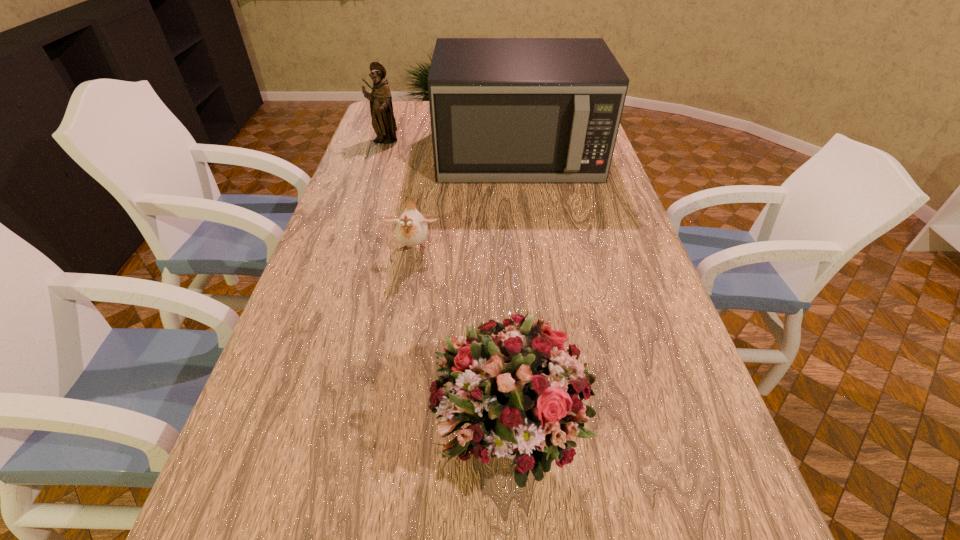
Select which object appears as the closest to the leftmost object. Please provide its 2D coordinates. Your answer should be formatted as a tuple, i.e. [(x, y)], where the tuple contains the x and y coordinates of a point satisfying the conditions above.

[(503, 110)]

Locate which object is the third closest to the nearest object. Please provide its 2D coordinates. Your answer should be formatted as a tuple, i.e. [(x, y)], where the tuple contains the x and y coordinates of a point satisfying the conditions above.

[(383, 122)]

Find the location of a particular element. Image resolution: width=960 pixels, height=540 pixels. free space that satisfies the following two spatial constraints: 1. on the front-facing side of the bouquet; 2. on the right side of the figurine is located at coordinates (290, 434).

Where is `free location that satisfies the following two spatial constraints: 1. at the beak of the bird; 2. on the left side of the nearest object`? free location that satisfies the following two spatial constraints: 1. at the beak of the bird; 2. on the left side of the nearest object is located at coordinates (383, 434).

This screenshot has width=960, height=540. I want to click on vacant region that satisfies the following two spatial constraints: 1. at the beak of the bird; 2. on the right side of the nearest object, so click(383, 434).

Locate an element on the screen. The width and height of the screenshot is (960, 540). vacant area in the image that satisfies the following two spatial constraints: 1. on the front-facing side of the bouquet; 2. on the left side of the figurine is located at coordinates (290, 434).